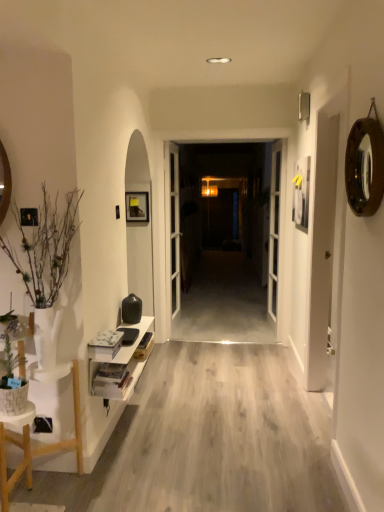
Question: Is white glossy shelf at lower left wider than light wood floor at center?

Choices:
 (A) no
 (B) yes

Answer: (A)

Question: Is white glossy shelf at lower left turned away from light wood floor at center?

Choices:
 (A) no
 (B) yes

Answer: (A)

Question: Is white glossy shelf at lower left positioned far away from light wood floor at center?

Choices:
 (A) no
 (B) yes

Answer: (A)

Question: Could you tell me if white glossy shelf at lower left is turned towards light wood floor at center?

Choices:
 (A) yes
 (B) no

Answer: (B)

Question: Can you see white glossy shelf at lower left touching light wood floor at center?

Choices:
 (A) yes
 (B) no

Answer: (B)

Question: Is light wood floor at center surrounded by white glossy shelf at lower left?

Choices:
 (A) yes
 (B) no

Answer: (B)

Question: Does transparent glass door at center have a larger size compared to gold metallic mirror at upper right?

Choices:
 (A) yes
 (B) no

Answer: (A)

Question: Is transparent glass door at center with gold metallic mirror at upper right?

Choices:
 (A) yes
 (B) no

Answer: (B)

Question: From a real-world perspective, does transparent glass door at center sit lower than gold metallic mirror at upper right?

Choices:
 (A) no
 (B) yes

Answer: (B)

Question: Is gold metallic mirror at upper right surrounded by transparent glass door at center?

Choices:
 (A) yes
 (B) no

Answer: (B)

Question: From the image's perspective, is transparent glass door at center below gold metallic mirror at upper right?

Choices:
 (A) no
 (B) yes

Answer: (B)

Question: Can you confirm if transparent glass door at center is wider than gold metallic mirror at upper right?

Choices:
 (A) no
 (B) yes

Answer: (A)

Question: Is white glossy door at center, which appears as the first door when viewed from the left, positioned in front of white textured stool at lower left?

Choices:
 (A) no
 (B) yes

Answer: (A)